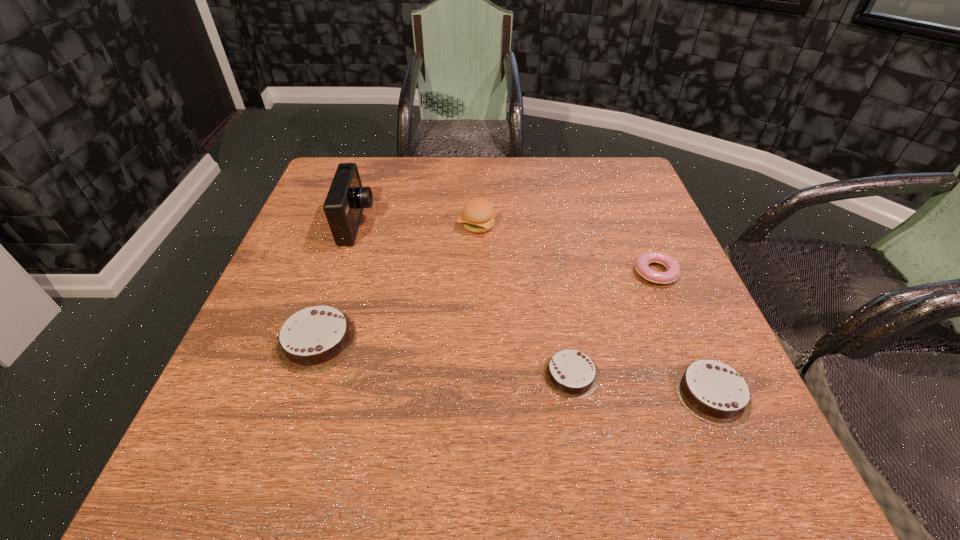
Locate an element on the screen. The image size is (960, 540). object that is at the far left corner is located at coordinates (346, 199).

The height and width of the screenshot is (540, 960). I want to click on object at the near right corner, so click(x=714, y=392).

At what (x,y) coordinates should I click in order to perform the action: click on vacant region at the far edge of the desktop. Please return your answer as a coordinate pair (x, y). The height and width of the screenshot is (540, 960). Looking at the image, I should click on (426, 158).

Identify the location of vacant space at the near edge of the desktop. Image resolution: width=960 pixels, height=540 pixels. (430, 420).

Locate an element on the screen. Image resolution: width=960 pixels, height=540 pixels. free point at the left edge is located at coordinates (305, 281).

This screenshot has width=960, height=540. In the image, there is a desktop. Find the location of `vacant space at the right edge`. vacant space at the right edge is located at coordinates (697, 303).

Where is `vacant space at the far right corner of the desktop`? This screenshot has height=540, width=960. vacant space at the far right corner of the desktop is located at coordinates (624, 191).

Locate an element on the screen. Image resolution: width=960 pixels, height=540 pixels. blank region between the tallest chocolate cake and the tallest object is located at coordinates (337, 282).

This screenshot has width=960, height=540. What are the coordinates of `vacant area that lies between the rightmost chocolate cake and the doughnut` in the screenshot? It's located at (684, 333).

Locate an element on the screen. This screenshot has width=960, height=540. vacant space in between the doughnut and the second chocolate cake from left to right is located at coordinates (613, 323).